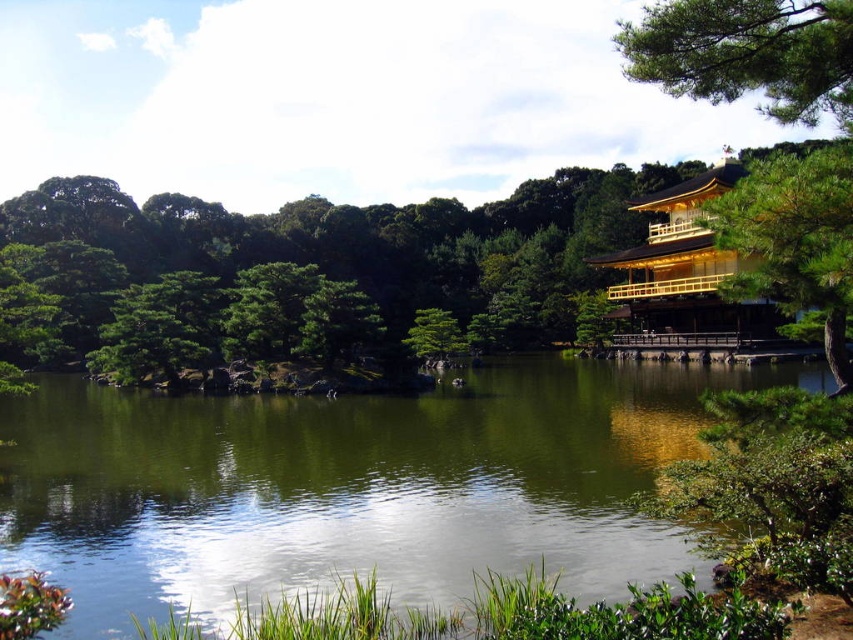
Question: Can you confirm if green leafy tree at upper right is positioned below green pine tree at upper right?

Choices:
 (A) no
 (B) yes

Answer: (A)

Question: Is green pine tree at upper right thinner than golden polished wood temple at right?

Choices:
 (A) no
 (B) yes

Answer: (B)

Question: Does green pine tree at upper right have a lesser width compared to golden polished wood temple at right?

Choices:
 (A) no
 (B) yes

Answer: (B)

Question: Considering the real-world distances, which object is closest to the green leafy tree at upper right?

Choices:
 (A) green pine tree at upper right
 (B) golden polished wood temple at right

Answer: (B)

Question: Which of these objects is positioned closest to the golden polished wood temple at right?

Choices:
 (A) green liquid water at center
 (B) green leafy tree at upper right
 (C) green pine tree at upper right

Answer: (A)

Question: Among these objects, which one is farthest from the camera?

Choices:
 (A) golden polished wood temple at right
 (B) green liquid water at center
 (C) green pine tree at upper right

Answer: (A)